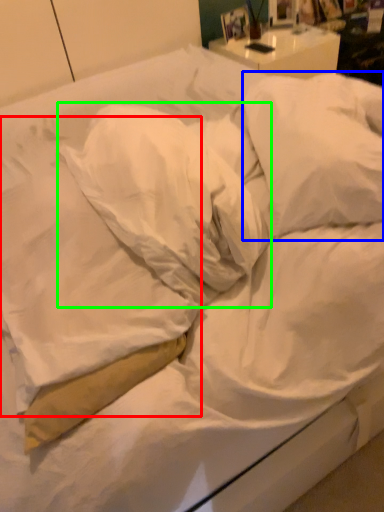
Question: Which object is the closest to the pillow (highlighted by a red box)? Choose among these: pillow (highlighted by a blue box) or pillow (highlighted by a green box).

Choices:
 (A) pillow
 (B) pillow

Answer: (B)